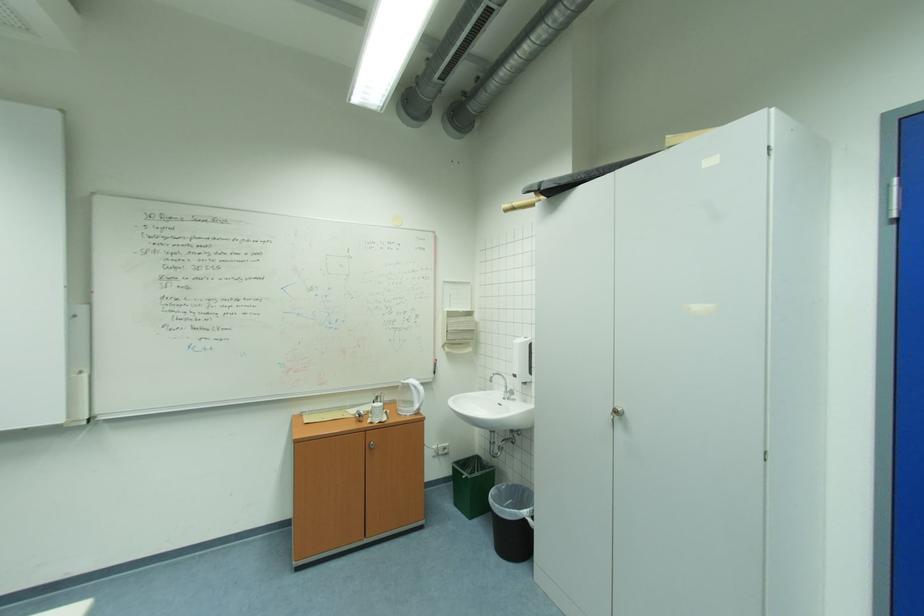
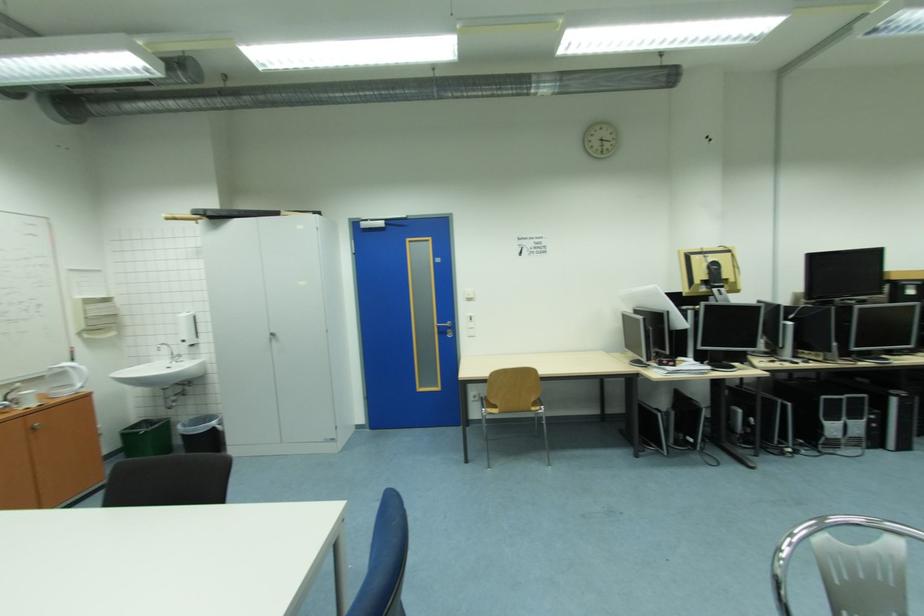
Where in the second image is the point corresponding to (532,513) from the first image?

(220, 424)